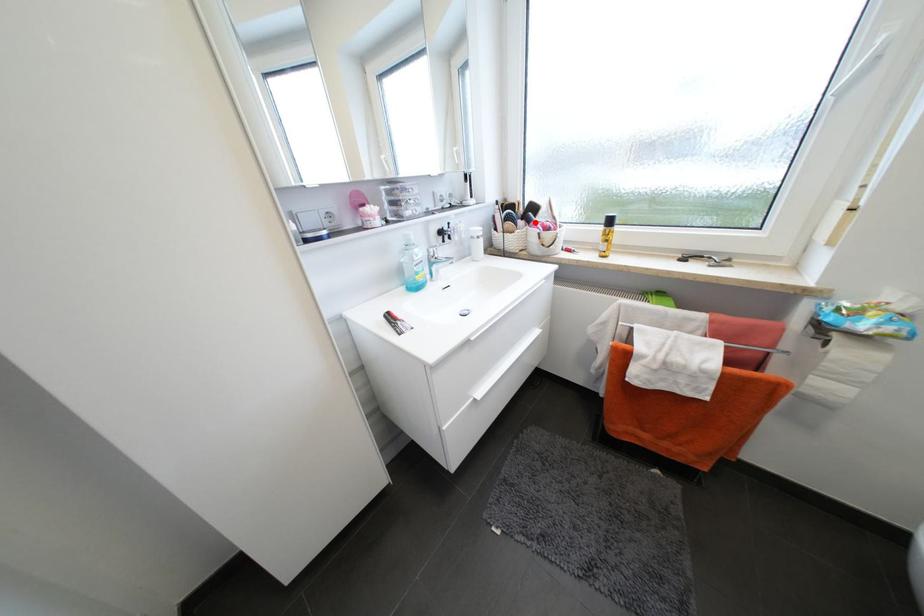
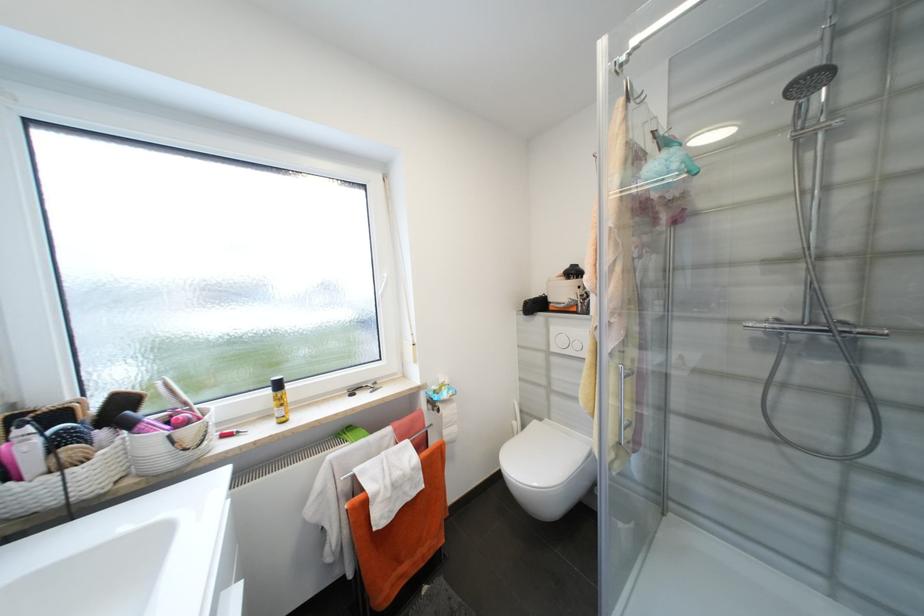
The point at the highlighted location is marked in the first image. Where is the corresponding point in the second image?

(134, 427)